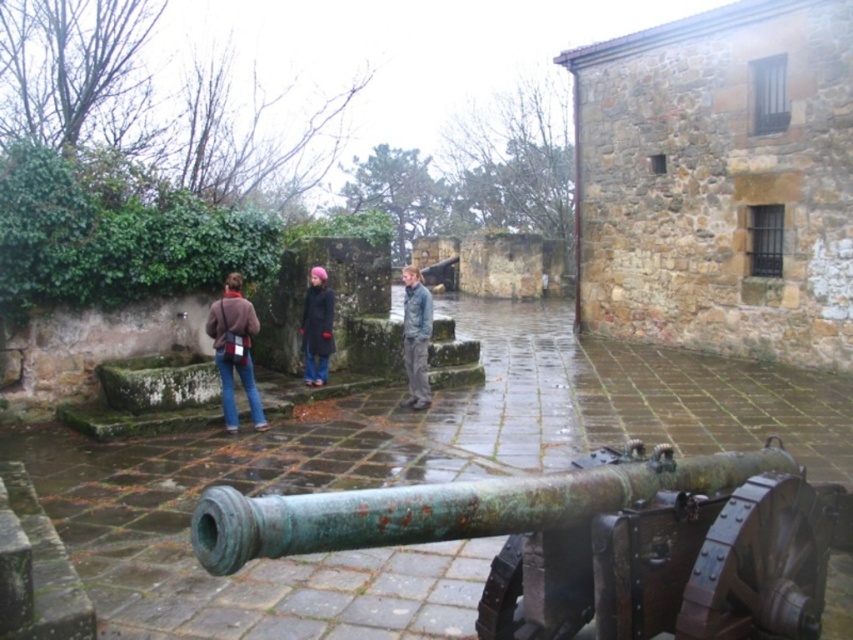
You are a photographer wanting to capture both the brown leather jacket at lower left and the denim jacket at center in a single shot. Based on their sizes in the image, which jacket would require you to step back further to include both fully in the frame?

The denim jacket at center occupies more space in the image than the brown leather jacket at lower left. To include both fully in the frame, you would need to step back further to accommodate the larger size of the denim jacket at center.

You are standing at the point marked as point (225,300) and want to walk to the cannon. The cannon is 13 meters away. Is the cannon to your left or right?

The cannon is to your left because the cannon is pointing towards the left side of the frame, and you are 13 meters away from it.